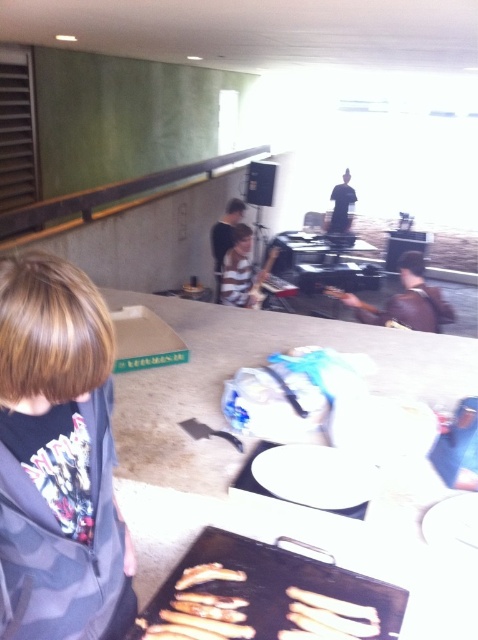
Who is taller, camo fabric jacket at lower left or brown leather jacket at center?

camo fabric jacket at lower left is taller.

Can you confirm if camo fabric jacket at lower left is wider than brown leather jacket at center?

Incorrect, camo fabric jacket at lower left's width does not surpass brown leather jacket at center's.

In order to click on camo fabric jacket at lower left in this screenshot , I will do `click(57, 452)`.

The height and width of the screenshot is (640, 478). Describe the element at coordinates (239, 269) in the screenshot. I see `striped fabric shirt at center` at that location.

This screenshot has height=640, width=478. What do you see at coordinates (239, 269) in the screenshot?
I see `striped fabric shirt at center` at bounding box center [239, 269].

Find the location of `striped fabric shirt at center`. striped fabric shirt at center is located at coordinates (239, 269).

Can you confirm if camo fabric jacket at lower left is wider than dark blue shirt at center?

In fact, camo fabric jacket at lower left might be narrower than dark blue shirt at center.

Who is higher up, camo fabric jacket at lower left or dark blue shirt at center?

dark blue shirt at center is higher up.

Who is more forward, (50, 387) or (334, 202)?

Point (50, 387) is more forward.

Where is `camo fabric jacket at lower left`? This screenshot has height=640, width=478. camo fabric jacket at lower left is located at coordinates (57, 452).